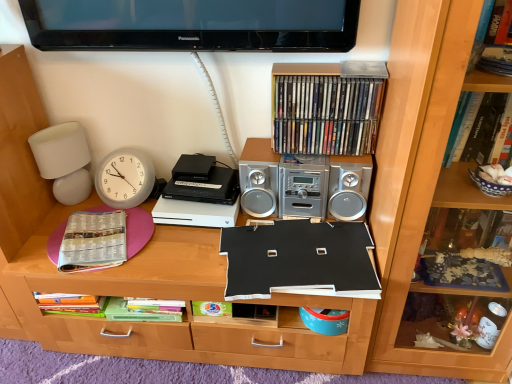
Find the location of `unoccupied region to the right of white paper at left, acting as the 1th paperback book starting from the left`. unoccupied region to the right of white paper at left, acting as the 1th paperback book starting from the left is located at coordinates (167, 255).